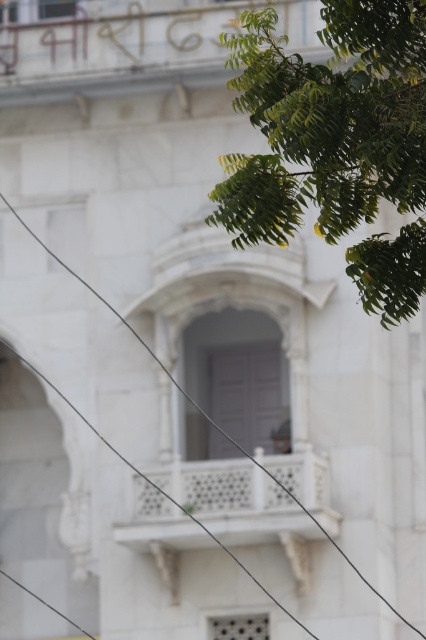
Is point (245, 93) behind point (85, 630)?

No, (245, 93) is closer to viewer.

Is point (405, 276) farther from viewer compared to point (46, 250)?

No, it is not.

You are a GUI agent. You are given a task and a screenshot of the screen. Output one action in this format:
    pyautogui.click(x=<x>, y=<y>)
    Task: Click on the green leafy tree at upper right
    
    Given the screenshot: What is the action you would take?
    pyautogui.click(x=328, y=122)